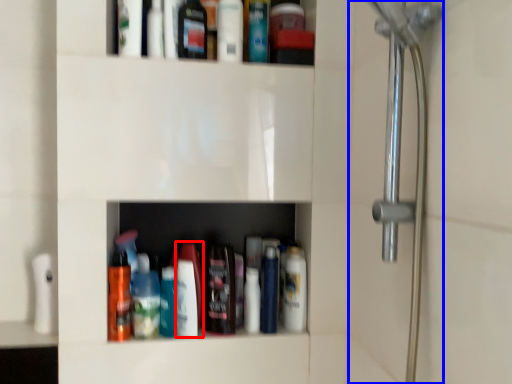
Question: Which object appears closest to the camera in this image, toiletry (highlighted by a red box) or shower door (highlighted by a blue box)?

Choices:
 (A) toiletry
 (B) shower door

Answer: (B)